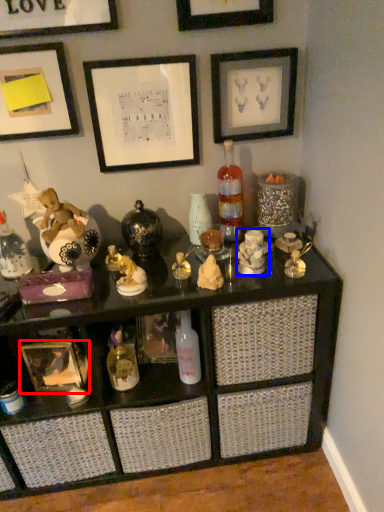
Question: Which object appears closest to the camera in this image, picture frame (highlighted by a red box) or toy (highlighted by a blue box)?

Choices:
 (A) picture frame
 (B) toy

Answer: (B)